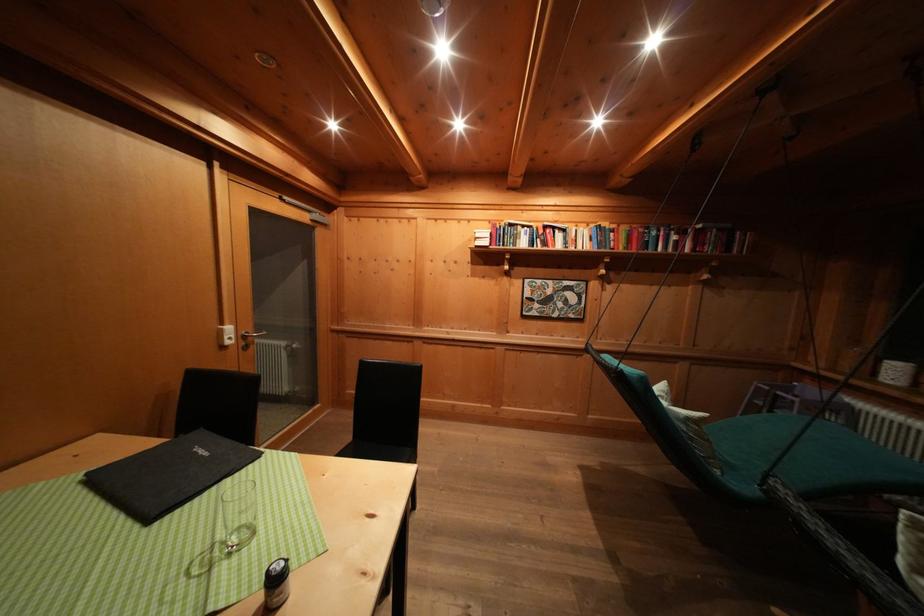
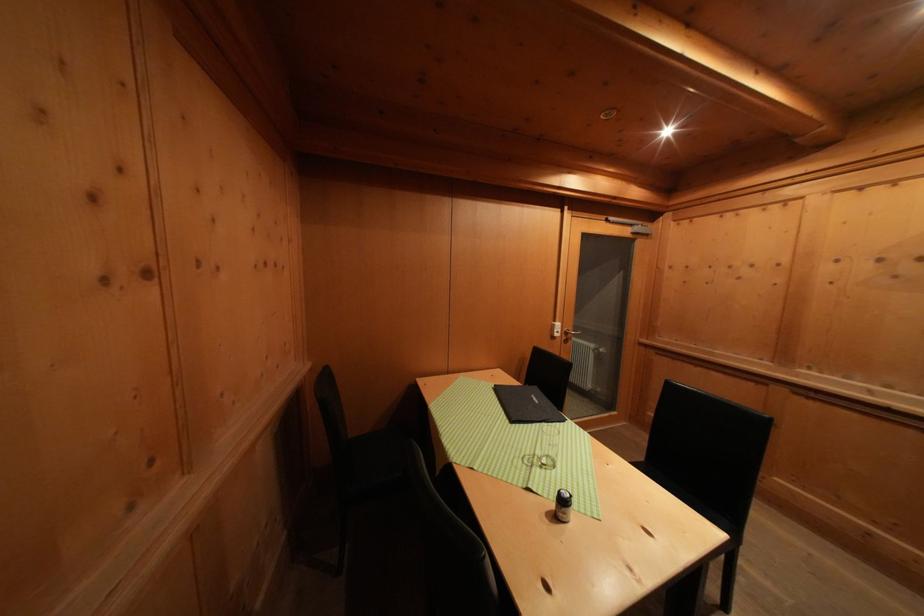
Where in the second image is the point corresponding to (x=228, y=329) from the first image?

(561, 326)